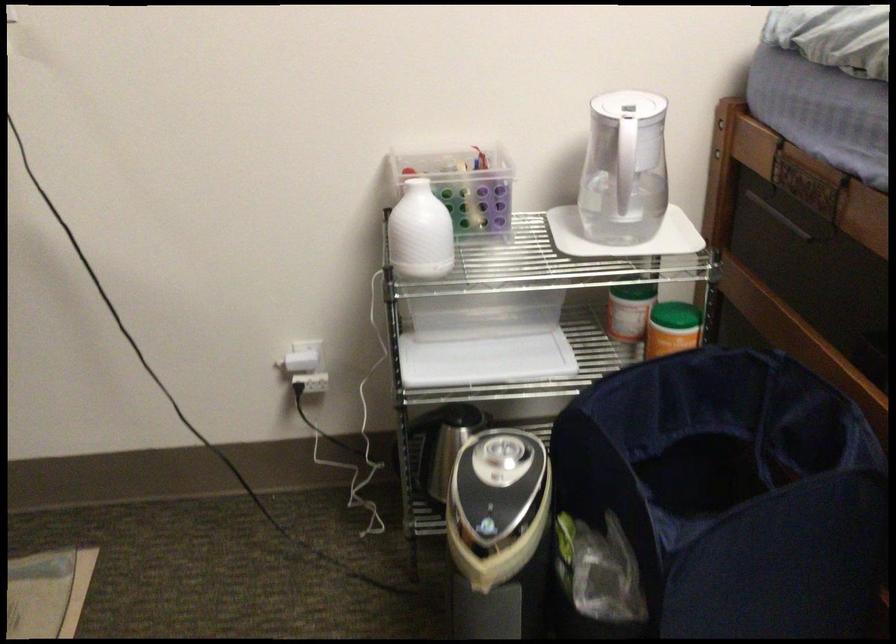
You are a GUI agent. You are given a task and a screenshot of the screen. Output one action in this format:
    pyautogui.click(x=<x>, y=<y>)
    Task: Click on the rice cooker button
    Image resolution: width=896 pixels, height=644 pixels.
    Given the screenshot: What is the action you would take?
    pyautogui.click(x=498, y=534)